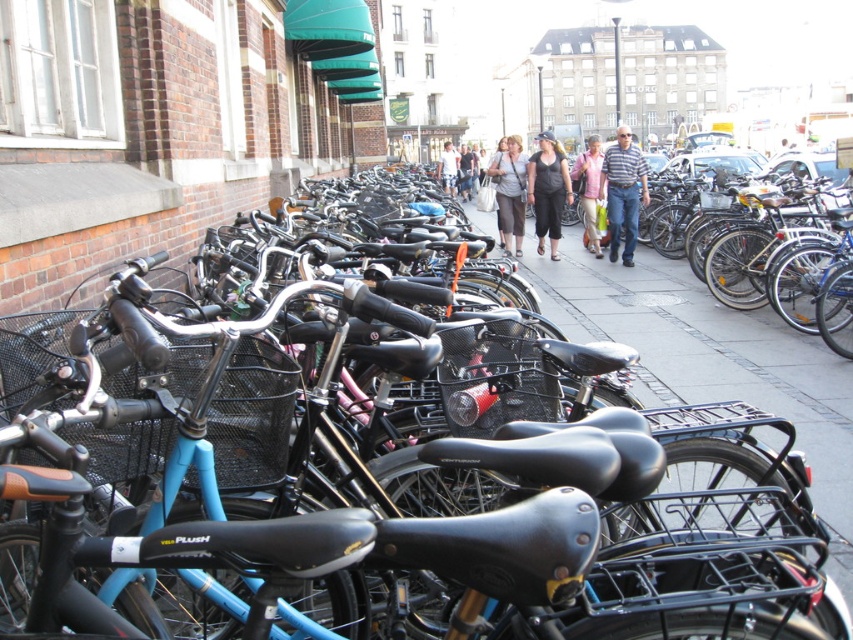
You are a delivery person trying to fit a package between two items in the image. The package is 1.2 meters wide. You see the light blue shorts at center and the light blue fabric pants at center. Can the package fit between them?

The light blue shorts at center might be wider than light blue fabric pants at center, so the space between them may be sufficient to fit the 1.2 meter wide package. However, since their exact width isn not specified, it is uncertain. Please check the actual dimensions before placing the package.

You are a fashion designer observing the urban scene. You notice two clothing items worn by a pedestrian at the center of the image. The items are the striped cotton shirt at center and the light blue fabric pants at center. Which clothing item is shorter in length?

The striped cotton shirt at center has a lesser height compared to the light blue fabric pants at center, so the striped cotton shirt at center is shorter in length.